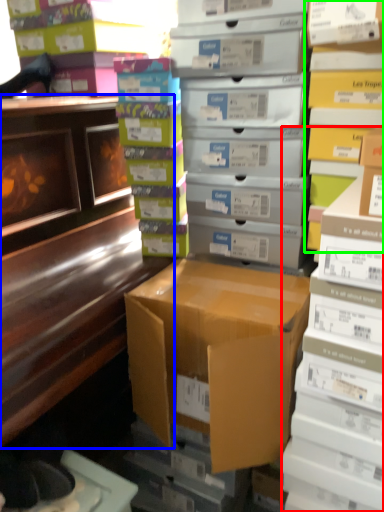
Question: Considering the real-world distances, which object is closest to book (highlighted by a red box)? desk (highlighted by a blue box) or shelf (highlighted by a green box).

Choices:
 (A) desk
 (B) shelf

Answer: (B)